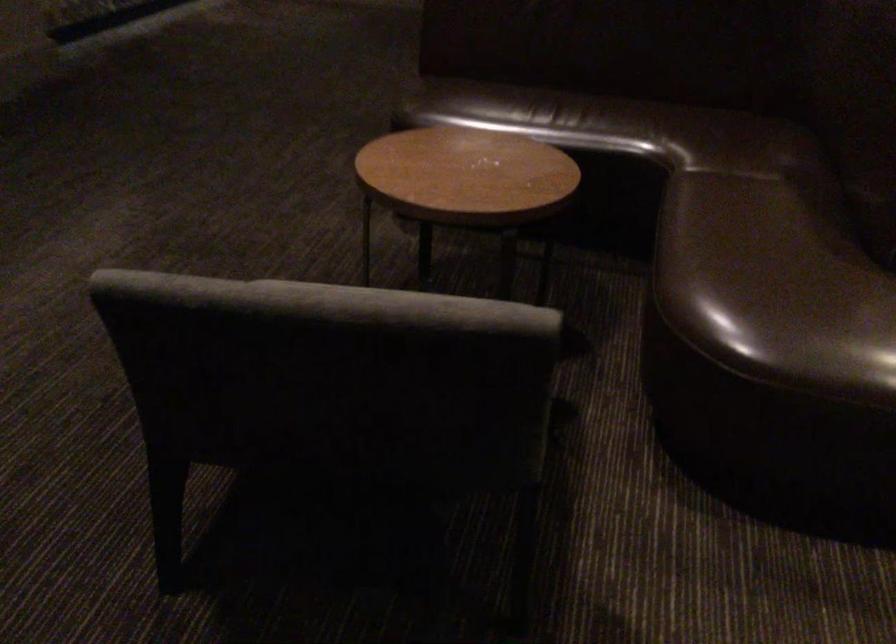
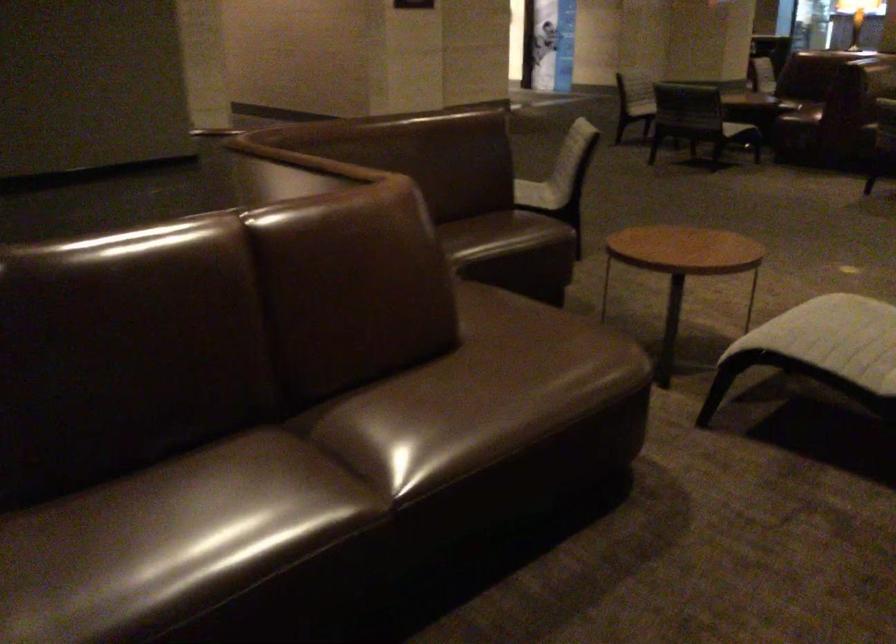
Question: The camera is either moving clockwise (left) or counter-clockwise (right) around the object. The first image is from the beginning of the video and the second image is from the end. Is the camera moving left or right when shooting the video?

Choices:
 (A) Left
 (B) Right

Answer: (A)